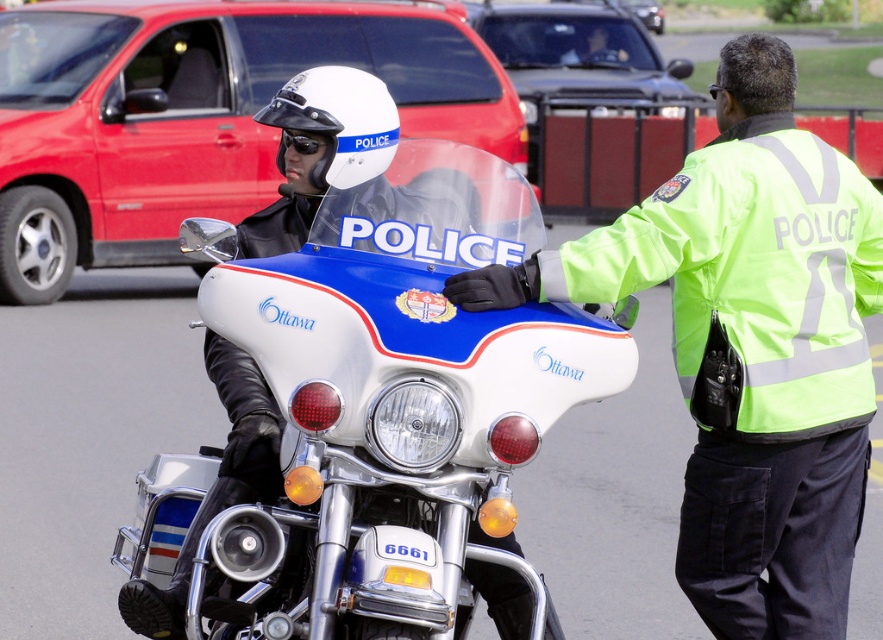
Who is positioned more to the right, white glossy police motorcycle at center or neon green reflective jacket at right?

neon green reflective jacket at right

Who is more forward, (223, 516) or (781, 464)?

Point (223, 516)

Locate an element on the screen. The width and height of the screenshot is (883, 640). white glossy police motorcycle at center is located at coordinates (380, 413).